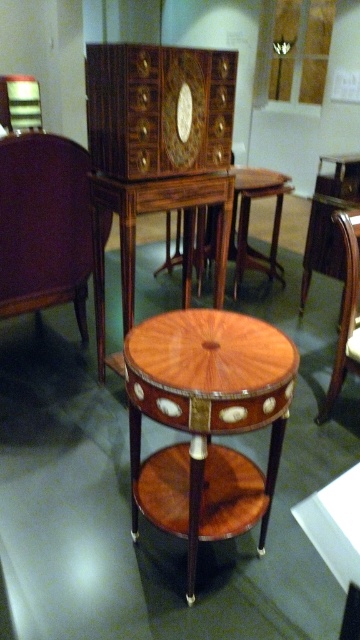
You are an interior designer planning to place a floor lamp next to the mahogany wood table at center and the mahogany veneer drawer at center. Which object should the lamp be placed closer to if it needs to cast light on the taller object?

The mahogany wood table at center is taller than the mahogany veneer drawer at center, so the lamp should be placed closer to the mahogany wood table at center to effectively cast light on it.

You are standing in the museum and see the mahogany wood table at center and the mahogany wood chair at center. If you face the table, which side would the chair be on?

The mahogany wood table at center is to the left of the mahogany wood chair at center. So, if you face the table, the chair would be on your right side.